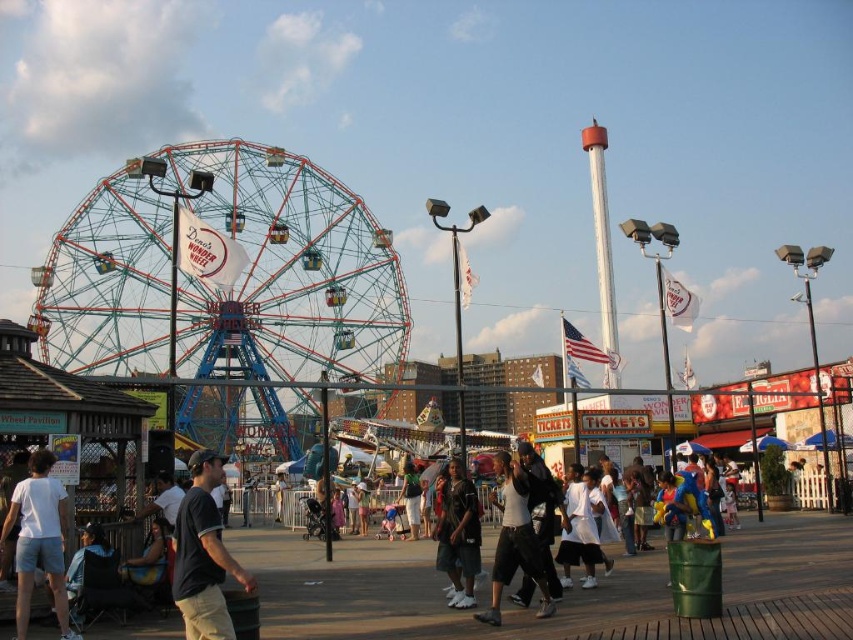
You are standing at the entrance of the boardwalk amusement park. You see a metallic wire ferris wheel at center marked by point (219, 282). Can you determine if the ferris wheel is located to the left or right of the entrance based on the coordinates provided?

The coordinates point (219, 282) marks the location of the metallic wire ferris wheel at center, so it is positioned at the center of the boardwalk amusement park. Therefore, the entrance is likely located either to the left or right, but the given information does not specify the exact direction relative to the entrance.